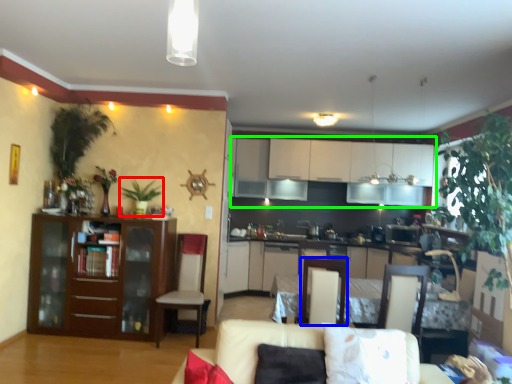
Question: Based on their relative distances, which object is farther from plant (highlighted by a red box)? Choose from armchair (highlighted by a blue box) and cabinetry (highlighted by a green box).

Choices:
 (A) armchair
 (B) cabinetry

Answer: (B)